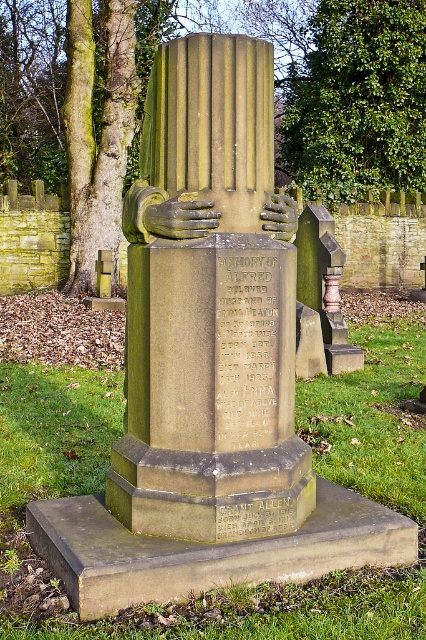
Based on the scene described, which object is closer to the observer? The green polished stone column at center or the green leafy tree at upper center?

The green polished stone column at center is closer to the observer because it is in front of the green leafy tree at upper center.

You are standing in front of the gravestone and notice the green polished stone column at center and the green leafy tree at upper center. Which object is positioned higher up in the image?

The green leafy tree at upper center is positioned higher up in the image than the green polished stone column at center.